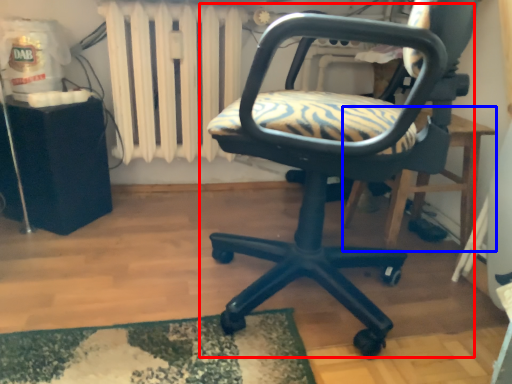
Question: Which point is closer to the camera, chair (highlighted by a red box) or table (highlighted by a blue box)?

Choices:
 (A) chair
 (B) table

Answer: (A)